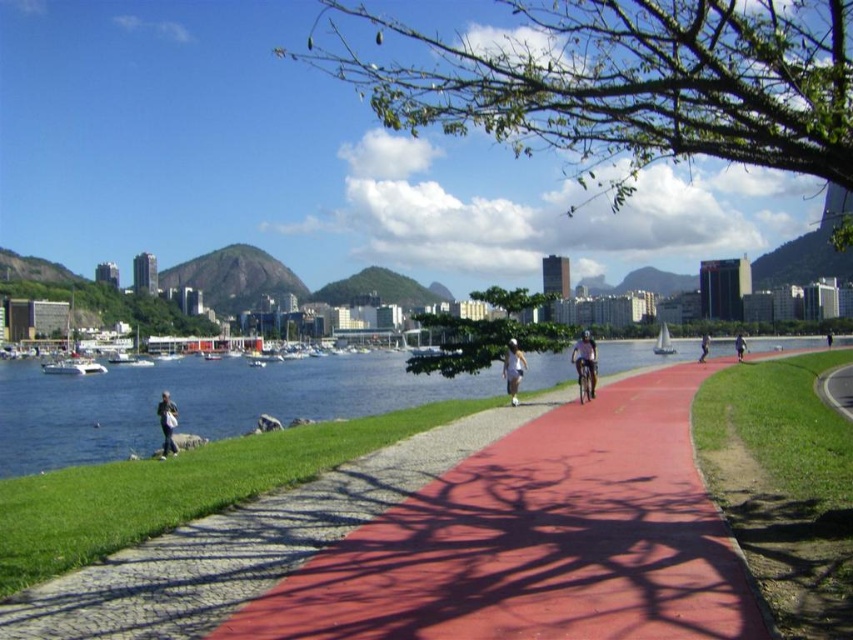
Question: Among these objects, which one is farthest from the camera?

Choices:
 (A) dark blue jeans at lower right
 (B) shiny red pavement at center
 (C) light gray fabric jacket at lower left

Answer: (A)

Question: Can you confirm if white matte shorts at center is smaller than dark blue fabric jacket at center?

Choices:
 (A) yes
 (B) no

Answer: (A)

Question: Which is nearer to the dark blue jeans at lower right?

Choices:
 (A) light blue fabric pants at center-right
 (B) white matte shorts at center
 (C) green grass at lower right
 (D) light gray fabric jacket at lower left

Answer: (A)

Question: Does white plastic boat at center appear on the right side of light blue fabric pants at center-right?

Choices:
 (A) yes
 (B) no

Answer: (B)

Question: Among these objects, which one is nearest to the camera?

Choices:
 (A) shiny red pavement at center
 (B) light blue fabric pants at center-right
 (C) green grass at lower right

Answer: (C)

Question: Can you confirm if green grass at lower right is positioned to the right of white matte shorts at center?

Choices:
 (A) no
 (B) yes

Answer: (B)